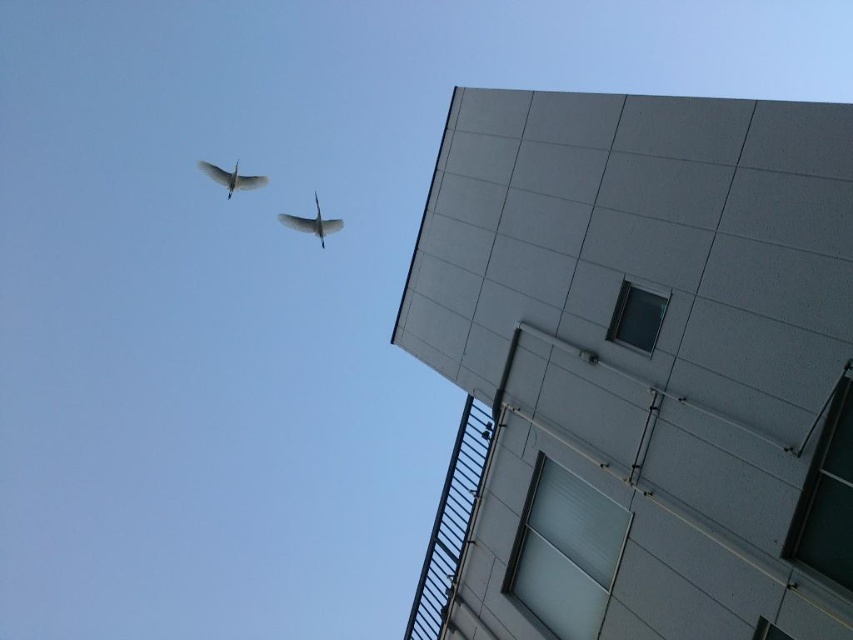
In the scene shown: Who is more forward, (236,182) or (305,221)?

Point (305,221) is in front.

Who is lower down, white matte bird at upper left or white glossy bird at upper center?

white glossy bird at upper center is below.

Which is in front, point (235, 188) or point (309, 224)?

Positioned in front is point (309, 224).

Identify the location of white matte bird at upper left. This screenshot has width=853, height=640. (231, 177).